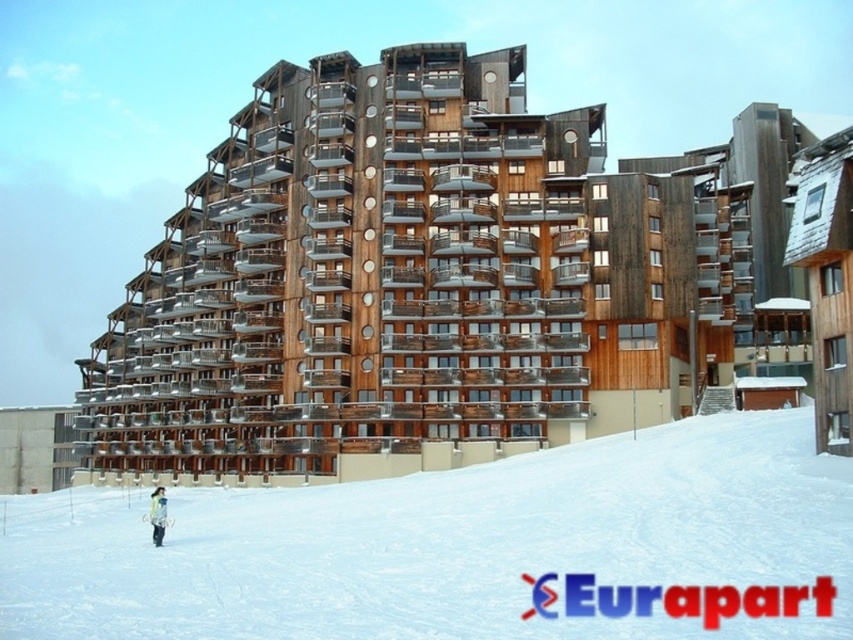
Consider the image. Does wooden building at center lie in front of white plastic ski at lower left?

No, wooden building at center is further to the viewer.

Is point (704, 240) closer to viewer compared to point (154, 520)?

No, (704, 240) is further to viewer.

Is point (231, 227) positioned after point (158, 525)?

That is True.

Locate an element on the screen. This screenshot has height=640, width=853. wooden building at center is located at coordinates (427, 275).

Does wooden building at center have a lesser width compared to light brown fur coat at lower left?

No, wooden building at center is not thinner than light brown fur coat at lower left.

Is point (641, 413) positioned after point (161, 531)?

That is True.

In order to click on wooden building at center in this screenshot , I will do `click(427, 275)`.

Does wooden building at center have a larger size compared to white powdery snow at center?

Correct, wooden building at center is larger in size than white powdery snow at center.

Is wooden building at center wider than white powdery snow at center?

Yes.

Is point (477, 298) in front of point (235, 632)?

No, (477, 298) is behind (235, 632).

Locate an element on the screen. This screenshot has width=853, height=640. wooden building at center is located at coordinates (427, 275).